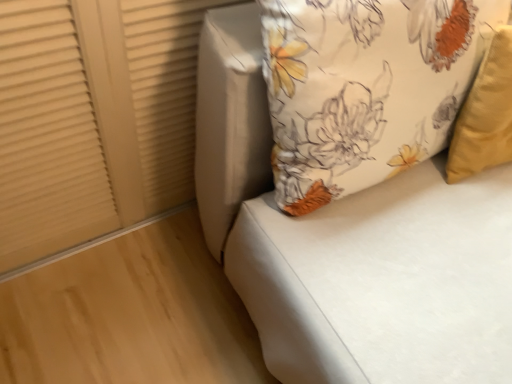
The height and width of the screenshot is (384, 512). In order to click on floral fabric pillow at upper right in this screenshot , I will do `click(365, 87)`.

You are a GUI agent. You are given a task and a screenshot of the screen. Output one action in this format:
    pyautogui.click(x=<x>, y=<y>)
    Task: Click on the furniture that appears in front of the floral fabric pillow at upper right
    The width and height of the screenshot is (512, 384).
    Given the screenshot: What is the action you would take?
    pyautogui.click(x=349, y=246)

Do you think floral fabric cushion at upper right is within floral fabric pillow at upper right, or outside of it?

floral fabric cushion at upper right is not inside floral fabric pillow at upper right, it's outside.

In the scene shown: From a real-world perspective, is floral fabric cushion at upper right on floral fabric pillow at upper right?

No, from a real-world perspective, floral fabric cushion at upper right is not above floral fabric pillow at upper right.

Between floral fabric cushion at upper right and floral fabric pillow at upper right, which one appears on the left side from the viewer's perspective?

From the viewer's perspective, floral fabric pillow at upper right appears more on the left side.

Considering the sizes of objects floral fabric cushion at upper right and matte beige shutter at upper left in the image provided, who is smaller, floral fabric cushion at upper right or matte beige shutter at upper left?

Smaller between the two is matte beige shutter at upper left.

Which is in front, point (215, 59) or point (63, 61)?

The point (215, 59) is closer to the camera.

Is floral fabric cushion at upper right wider or thinner than matte beige shutter at upper left?

floral fabric cushion at upper right is wider than matte beige shutter at upper left.

Would you say matte beige shutter at upper left is part of floral fabric pillow at upper right's contents?

Definitely not — matte beige shutter at upper left is not inside floral fabric pillow at upper right.

From the image's perspective, which is below, floral fabric pillow at upper right or matte beige shutter at upper left?

matte beige shutter at upper left is shown below in the image.

Is floral fabric pillow at upper right to the left or to the right of floral fabric cushion at upper right in the image?

floral fabric pillow at upper right is positioned on floral fabric cushion at upper right's left side.

Is floral fabric pillow at upper right far away from floral fabric cushion at upper right?

No, floral fabric pillow at upper right is not far away from floral fabric cushion at upper right.

The image size is (512, 384). In order to click on pillow to the left of floral fabric cushion at upper right in this screenshot , I will do `click(365, 87)`.

Where is `pillow above the matte beige shutter at upper left (from a real-world perspective)`? pillow above the matte beige shutter at upper left (from a real-world perspective) is located at coordinates (365, 87).

Which of these two, matte beige shutter at upper left or floral fabric pillow at upper right, is thinner?

Thinner between the two is matte beige shutter at upper left.

In the scene shown: How distant is matte beige shutter at upper left from floral fabric pillow at upper right?

matte beige shutter at upper left and floral fabric pillow at upper right are 16.27 inches apart.

Between matte beige shutter at upper left and floral fabric pillow at upper right, which one is positioned in front?

floral fabric pillow at upper right is in front.

Is matte beige shutter at upper left wider than floral fabric cushion at upper right?

No.

From a real-world perspective, is matte beige shutter at upper left below floral fabric cushion at upper right?

Indeed, from a real-world perspective, matte beige shutter at upper left is positioned beneath floral fabric cushion at upper right.

Looking at this image, how much distance is there between matte beige shutter at upper left and floral fabric cushion at upper right?

They are 15.78 inches apart.

From the image's perspective, is matte beige shutter at upper left located beneath floral fabric cushion at upper right?

No, from the image's perspective, matte beige shutter at upper left is not beneath floral fabric cushion at upper right.

The image size is (512, 384). In order to click on furniture located in front of the floral fabric pillow at upper right in this screenshot , I will do `click(349, 246)`.

Identify the location of shutter that is behind the floral fabric cushion at upper right. The height and width of the screenshot is (384, 512). (93, 118).

From the image, which object appears to be farther from matte beige shutter at upper left, floral fabric pillow at upper right or floral fabric cushion at upper right?

floral fabric pillow at upper right lies further to matte beige shutter at upper left than the other object.

When comparing their distances from matte beige shutter at upper left, does floral fabric cushion at upper right or floral fabric pillow at upper right seem further?

floral fabric pillow at upper right lies further to matte beige shutter at upper left than the other object.

When comparing their distances from floral fabric pillow at upper right, does matte beige shutter at upper left or floral fabric cushion at upper right seem further?

matte beige shutter at upper left lies further to floral fabric pillow at upper right than the other object.

When comparing their distances from floral fabric pillow at upper right, does floral fabric cushion at upper right or matte beige shutter at upper left seem closer?

Based on the image, floral fabric cushion at upper right appears to be nearer to floral fabric pillow at upper right.

From the image, which object appears to be nearer to floral fabric cushion at upper right, matte beige shutter at upper left or floral fabric pillow at upper right?

Based on the image, floral fabric pillow at upper right appears to be nearer to floral fabric cushion at upper right.

Based on their spatial positions, is floral fabric pillow at upper right or matte beige shutter at upper left closer to floral fabric cushion at upper right?

floral fabric pillow at upper right is positioned closer to the anchor floral fabric cushion at upper right.

This screenshot has height=384, width=512. In order to click on pillow located between matte beige shutter at upper left and floral fabric cushion at upper right in the left-right direction in this screenshot , I will do `click(365, 87)`.